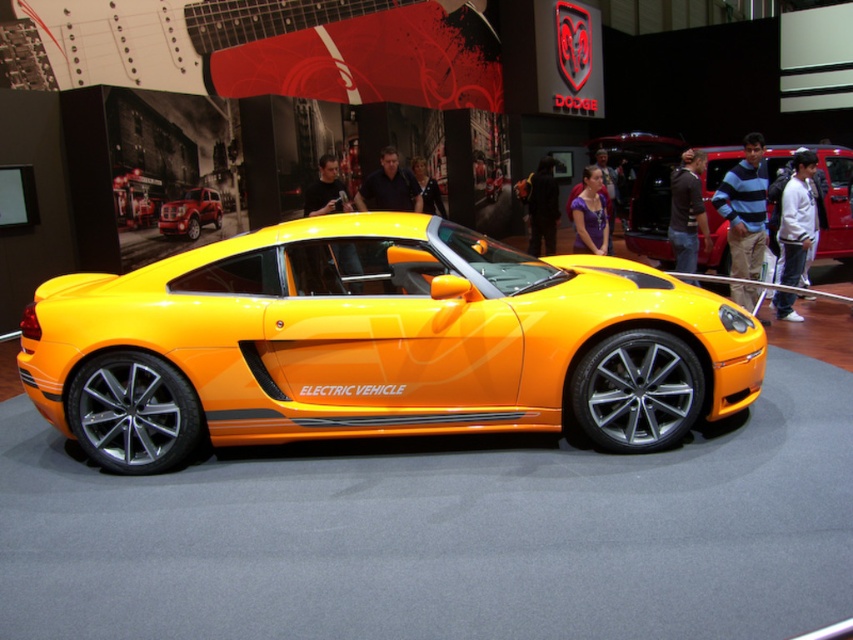
Question: Can you confirm if shiny metallic car at center is positioned to the right of shiny red suv at center?

Choices:
 (A) yes
 (B) no

Answer: (A)

Question: Can you confirm if shiny metallic car at center is positioned to the right of shiny red suv at center?

Choices:
 (A) yes
 (B) no

Answer: (A)

Question: Which of these objects is positioned closest to the shiny orange electric vehicle at center?

Choices:
 (A) shiny red suv at center
 (B) shiny metallic car at center

Answer: (A)

Question: Which point is farther from the camera taking this photo?

Choices:
 (A) (213, 195)
 (B) (361, 378)
 (C) (618, 141)

Answer: (C)

Question: Does shiny orange electric vehicle at center appear over shiny metallic car at center?

Choices:
 (A) yes
 (B) no

Answer: (B)

Question: Which point is farther to the camera?

Choices:
 (A) shiny red suv at center
 (B) shiny orange electric vehicle at center

Answer: (A)